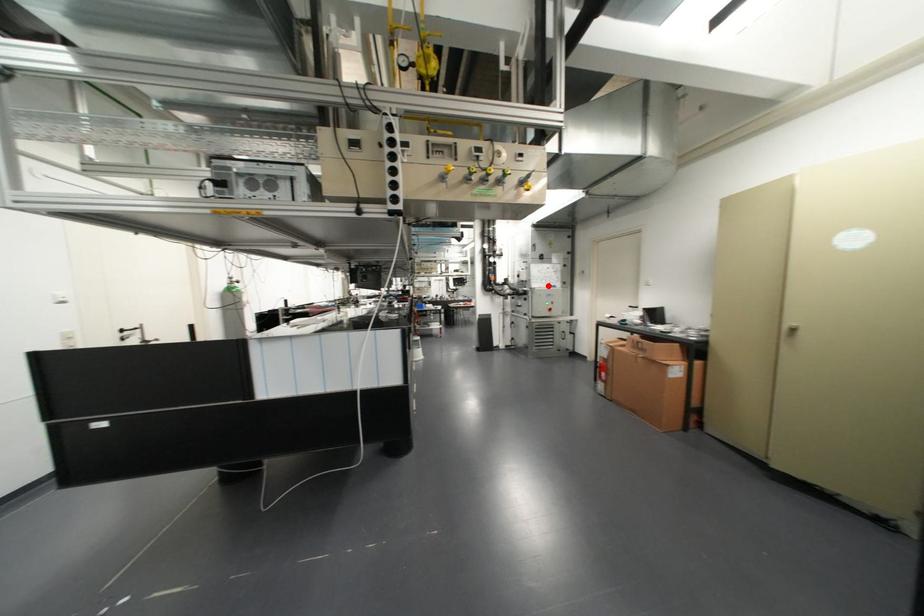
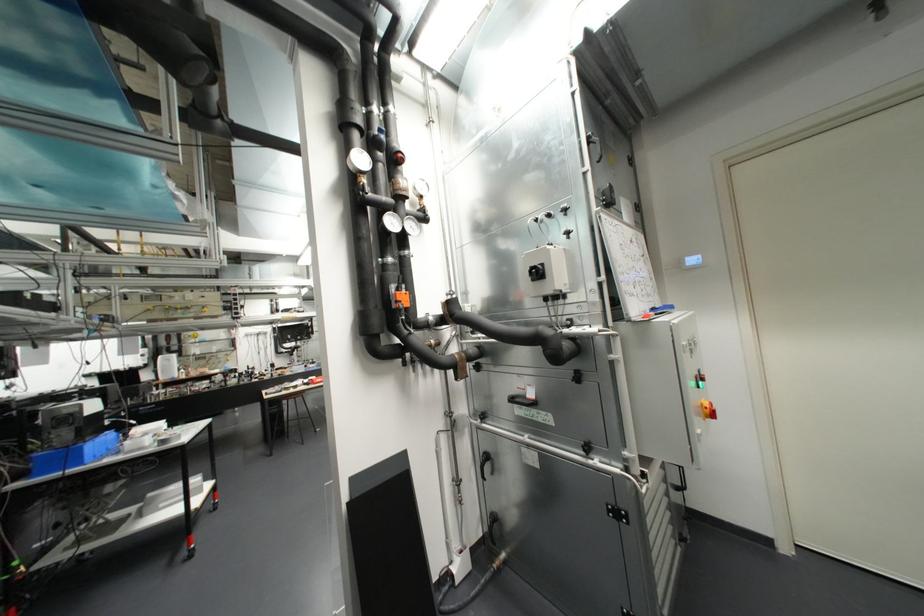
Find the pixel in the second image that matches the highlighted location in the first image.

(651, 309)